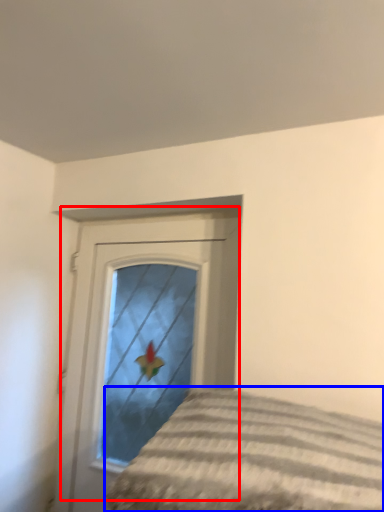
Question: Which point is closer to the camera, door (highlighted by a red box) or bed (highlighted by a blue box)?

Choices:
 (A) door
 (B) bed

Answer: (B)